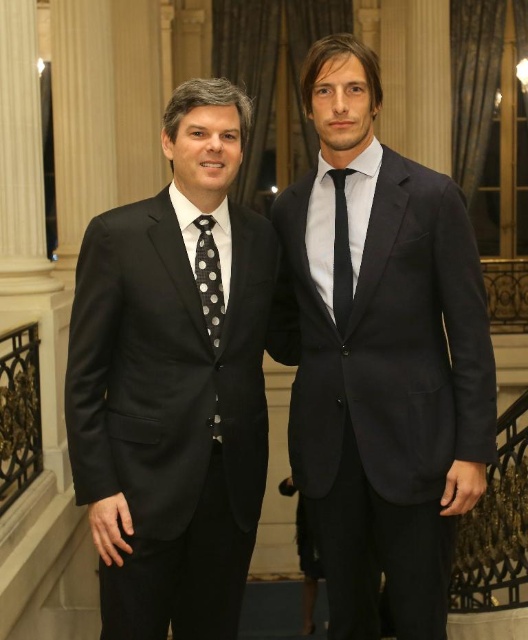
Can you confirm if matte black suit at left is shorter than black dotted fabric tie at left?

No.

Describe the element at coordinates (174, 381) in the screenshot. I see `matte black suit at left` at that location.

Locate an element on the screen. matte black suit at left is located at coordinates (174, 381).

Does dark blue suit at center have a greater height compared to black dotted fabric tie at left?

Correct, dark blue suit at center is much taller as black dotted fabric tie at left.

Is point (418, 278) behind point (202, 241)?

Yes.

The height and width of the screenshot is (640, 528). In order to click on dark blue suit at center in this screenshot , I will do `click(381, 358)`.

In the scene shown: Who is higher up, matte black suit at left or black silk tie at center?

black silk tie at center

Which is behind, point (248, 352) or point (343, 252)?

The point (343, 252) is more distant.

Does point (137, 580) come closer to viewer compared to point (335, 188)?

Yes, point (137, 580) is in front of point (335, 188).

The width and height of the screenshot is (528, 640). Identify the location of matte black suit at left. click(x=174, y=381).